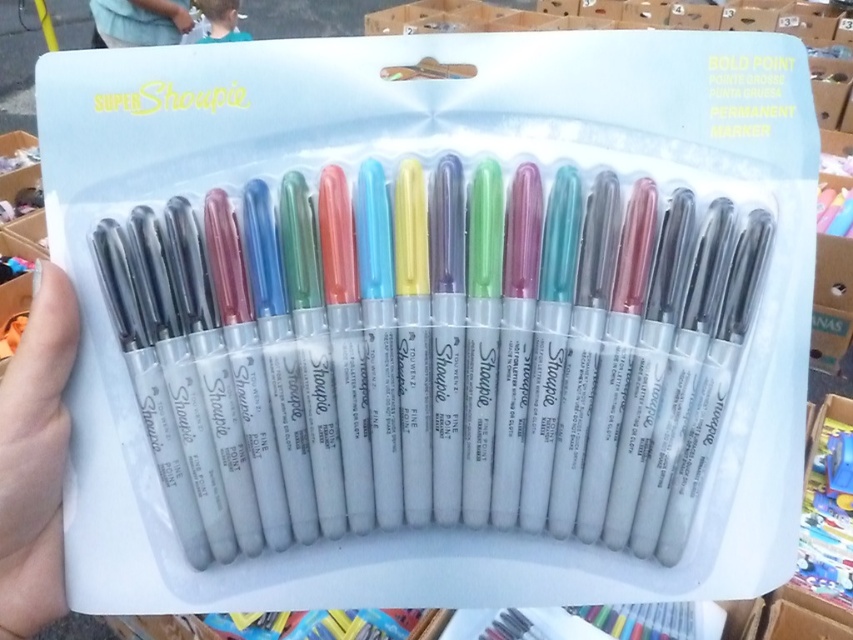
Question: Does white matte hand at lower left have a smaller size compared to blue fabric shirt at upper center?

Choices:
 (A) yes
 (B) no

Answer: (A)

Question: Is translucent plastic markers at center below blue fabric shirt at upper center?

Choices:
 (A) yes
 (B) no

Answer: (A)

Question: Which point is farther to the camera?

Choices:
 (A) (38, 568)
 (B) (225, 16)
 (C) (270, 252)
 (D) (173, 17)

Answer: (B)

Question: Which object appears closest to the camera in this image?

Choices:
 (A) white matte hand at lower left
 (B) blue fabric at upper left
 (C) translucent plastic markers at center
 (D) blue fabric shirt at upper center

Answer: (A)

Question: Observing the image, what is the correct spatial positioning of translucent plastic markers at center in reference to blue fabric shirt at upper center?

Choices:
 (A) right
 (B) left

Answer: (A)

Question: Estimate the real-world distances between objects in this image. Which object is closer to the blue fabric shirt at upper center?

Choices:
 (A) translucent plastic markers at center
 (B) blue fabric at upper left

Answer: (B)